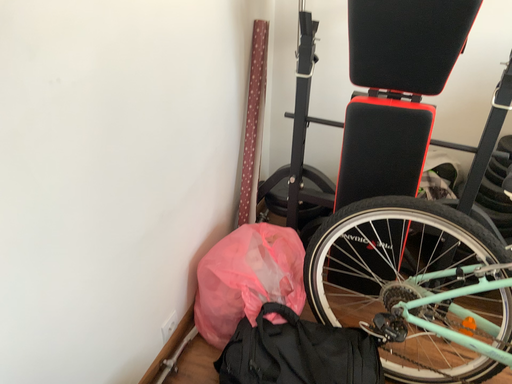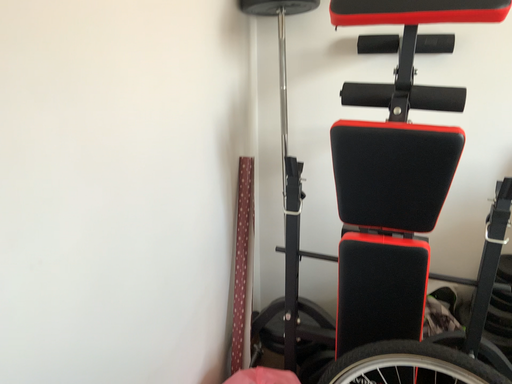
Question: How did the camera likely rotate when shooting the video?

Choices:
 (A) rotated upward
 (B) rotated downward

Answer: (A)